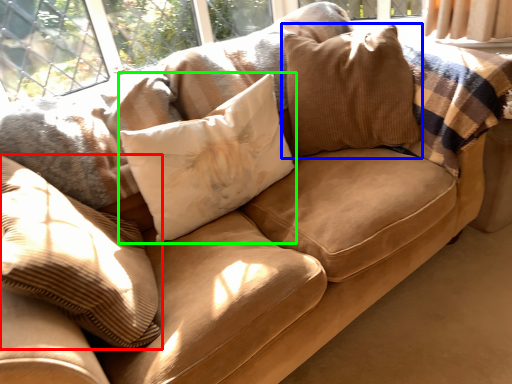
Question: Which object is positioned closest to pillow (highlighted by a red box)? Select from pillow (highlighted by a blue box) and pillow (highlighted by a green box).

Choices:
 (A) pillow
 (B) pillow

Answer: (B)